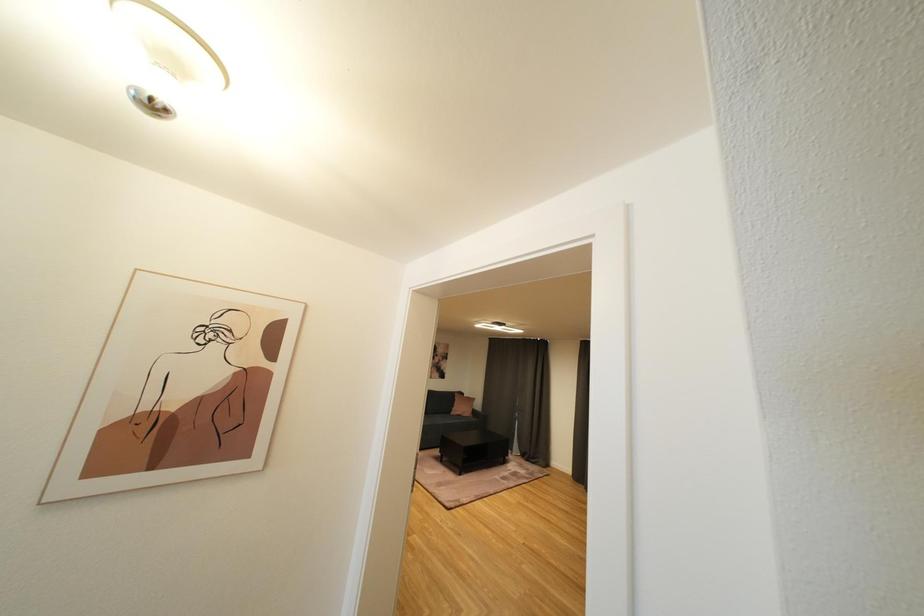
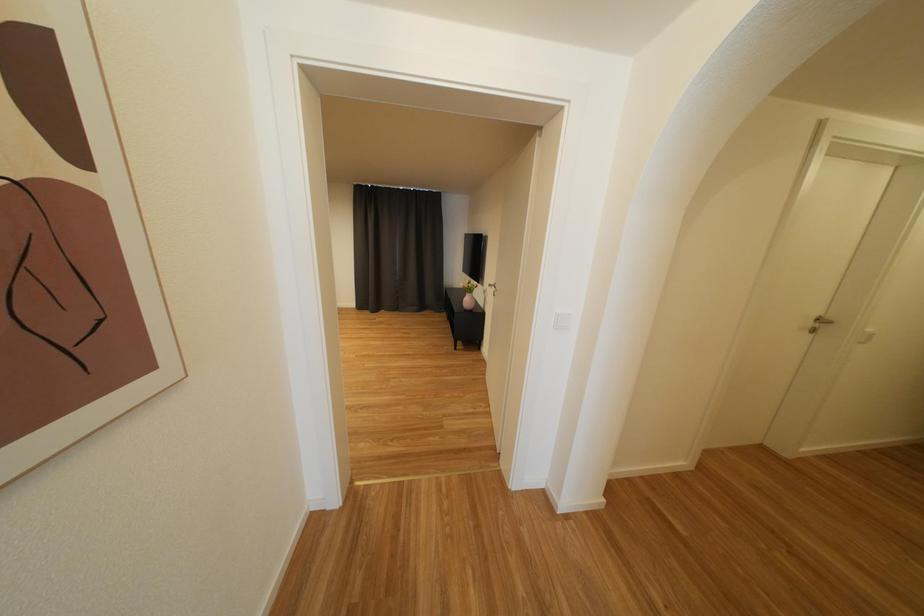
How did the camera likely rotate?

The camera rotated toward right-down.